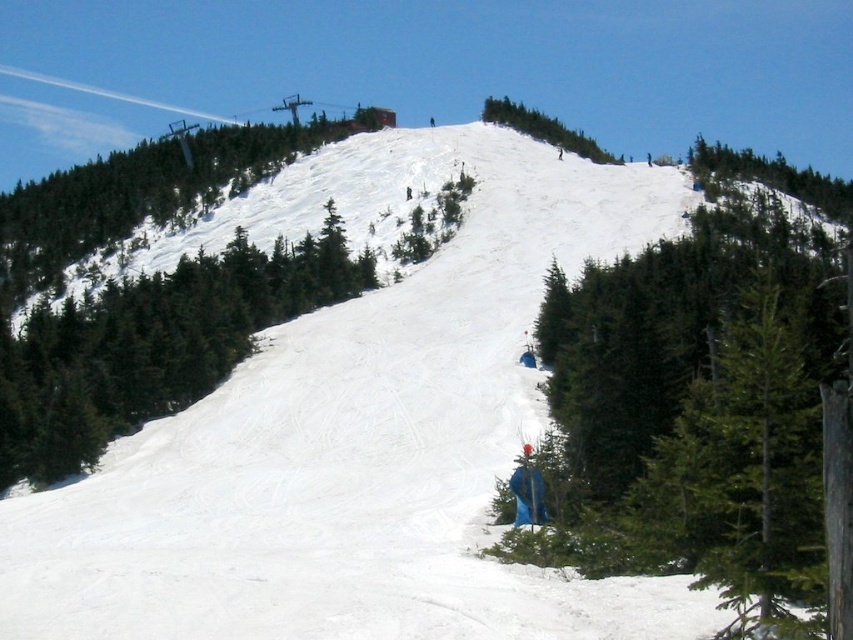
You are a skier planning to take a shortcut between the green matte tree at center and the green textured tree at upper center. Which tree should you aim for if you want to reach the closer one first?

The green matte tree at center is closer to the viewer than the green textured tree at upper center, so you should aim for the green matte tree at center to reach the closer one first.

You are a photographer planning to capture a panoramic view of the ski slope. You have two trees in your frame, the green matte tree at lower right and the green textured tree at upper center. Which tree should you focus on if you want to highlight the tallest tree in the scene?

The green textured tree at upper center is taller than the green matte tree at lower right, so you should focus on the green textured tree at upper center to highlight the tallest tree in the scene.

You are a skier planning to take a shortcut to the bottom of the slope. You see a point marked at coordinates point (154, 346). What is located at that point?

The point (154, 346) indicates a green matte tree at center, so you should avoid that area as it is occupied by a tree.